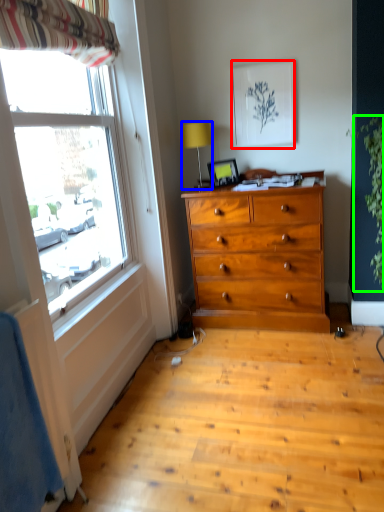
Question: Based on their relative distances, which object is nearer to picture frame (highlighted by a red box)? Choose from lamp (highlighted by a blue box) and plant (highlighted by a green box).

Choices:
 (A) lamp
 (B) plant

Answer: (A)